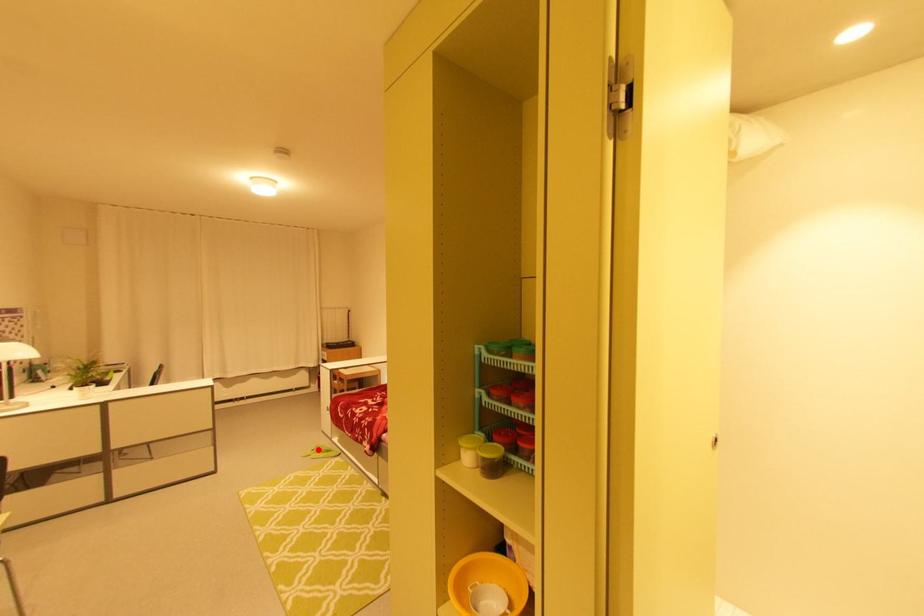
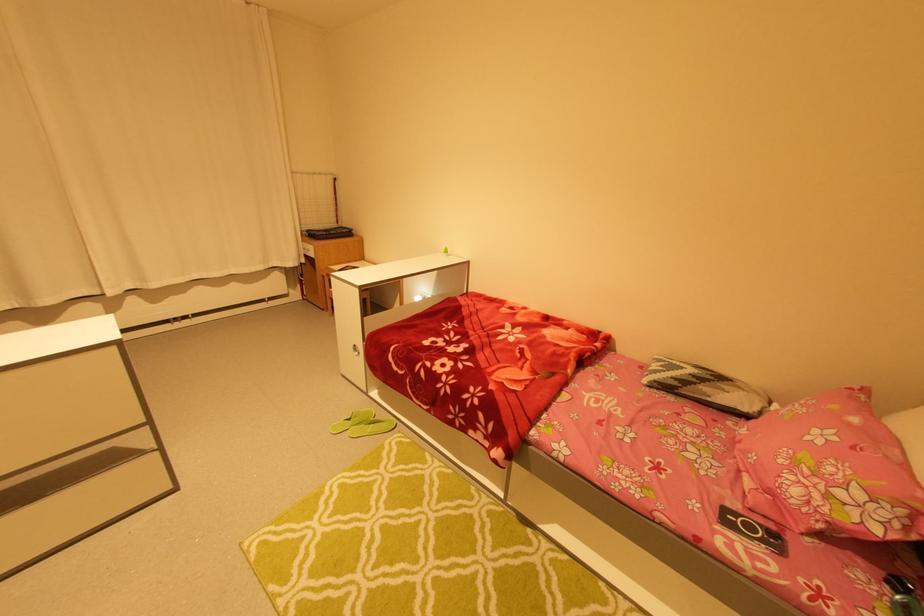
Question: A red point is marked in image1. In image2, is the corresponding 3D point closer to the camera or farther? Reply with the corresponding letter.

Choices:
 (A) The corresponding 3D point is closer.
 (B) The corresponding 3D point is farther.

Answer: (A)